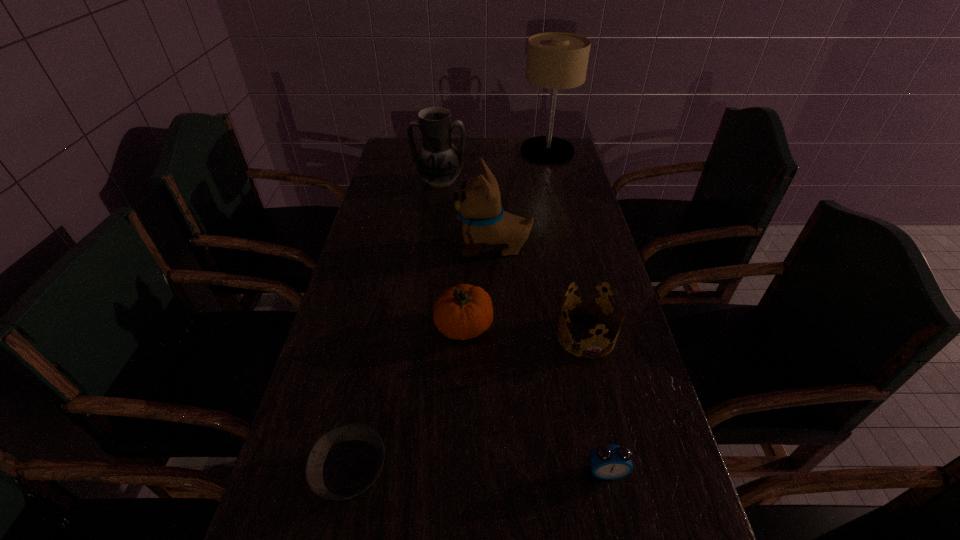
Image resolution: width=960 pixels, height=540 pixels. What are the coordinates of `table lamp` in the screenshot? It's located at (555, 60).

At what (x,y) coordinates should I click in order to perform the action: click on the farthest object. Please return your answer as a coordinate pair (x, y). The image size is (960, 540). Looking at the image, I should click on (555, 60).

At what (x,y) coordinates should I click in order to perform the action: click on the third farthest object. Please return your answer as a coordinate pair (x, y). This screenshot has width=960, height=540. Looking at the image, I should click on (484, 221).

The height and width of the screenshot is (540, 960). I want to click on the sixth nearest object, so click(438, 162).

You are a GUI agent. You are given a task and a screenshot of the screen. Output one action in this format:
    pyautogui.click(x=<x>, y=<y>)
    Task: Click on the pumpkin
    The width and height of the screenshot is (960, 540).
    Given the screenshot: What is the action you would take?
    pyautogui.click(x=464, y=311)

Where is `crown`? Image resolution: width=960 pixels, height=540 pixels. crown is located at coordinates (595, 297).

Find the location of a particular element. Image resolution: width=960 pixels, height=540 pixels. alarm clock is located at coordinates (609, 462).

Where is `bowl`? This screenshot has width=960, height=540. bowl is located at coordinates (344, 462).

The width and height of the screenshot is (960, 540). Identify the location of vacant region located 0.130m on the left of the tallest object. (488, 151).

You are a GUI agent. You are given a task and a screenshot of the screen. Output one action in this format:
    pyautogui.click(x=<x>, y=<y>)
    Task: Click on the free space located on the face of the fifth nearest object
    This screenshot has height=540, width=960.
    Given the screenshot: What is the action you would take?
    pyautogui.click(x=368, y=247)